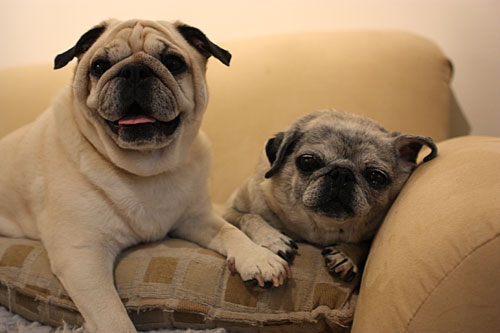
The image size is (500, 333). I want to click on couch, so click(x=463, y=240), click(x=261, y=100).